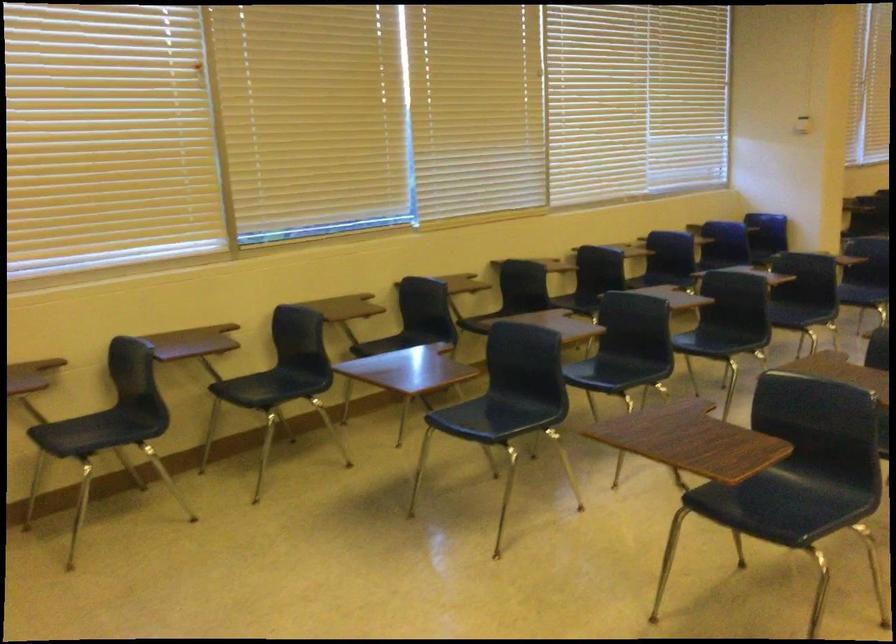
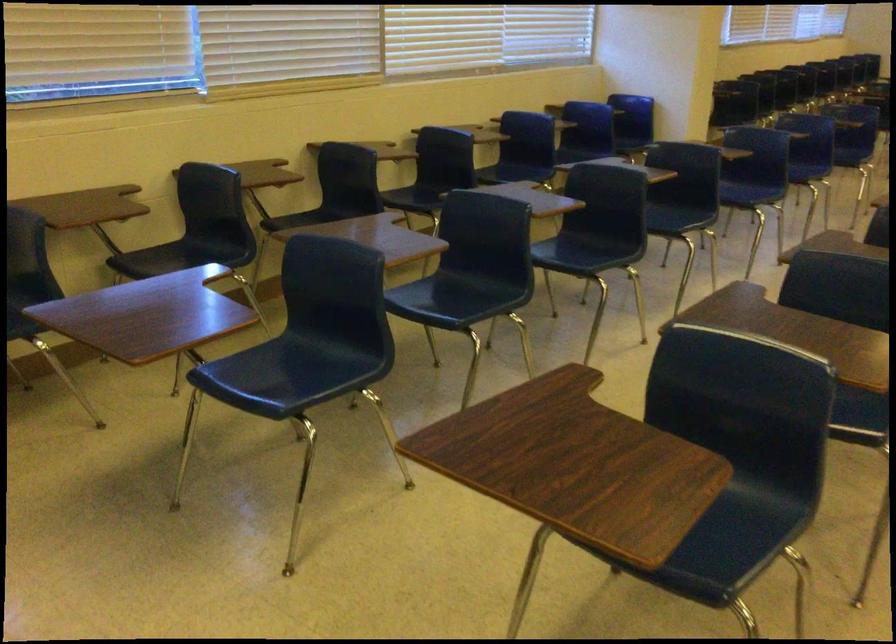
In the second image, find the point that corresponds to [616,366] in the first image.

(462, 292)